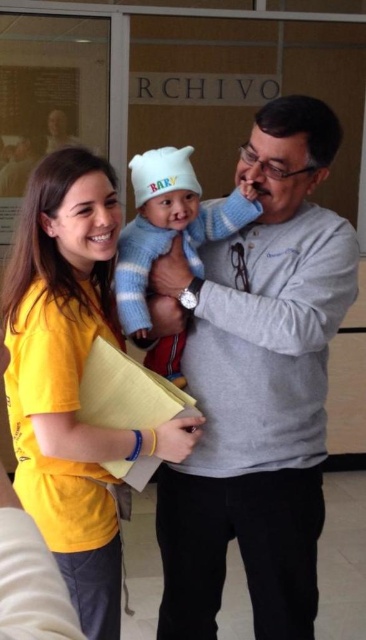
Which is below, yellow fabric shirt at center or blue striped sweater at center?

yellow fabric shirt at center is below.

The height and width of the screenshot is (640, 366). Find the location of `yellow fabric shirt at center`. yellow fabric shirt at center is located at coordinates (71, 378).

Which is behind, point (178, 429) or point (118, 314)?

The point (118, 314) is behind.

In order to click on yellow fabric shirt at center in this screenshot , I will do `click(71, 378)`.

Is gray cotton sweater at center smaller than blue striped sweater at center?

Actually, gray cotton sweater at center might be larger than blue striped sweater at center.

How much distance is there between gray cotton sweater at center and blue striped sweater at center?

A distance of 9.96 inches exists between gray cotton sweater at center and blue striped sweater at center.

At what (x,y) coordinates should I click in order to perform the action: click on gray cotton sweater at center. Please return your answer as a coordinate pair (x, y). This screenshot has width=366, height=640. Looking at the image, I should click on (258, 387).

Who is higher up, gray cotton sweater at center or yellow fabric shirt at center?

yellow fabric shirt at center is above.

Can you confirm if gray cotton sweater at center is positioned below yellow fabric shirt at center?

Yes.

What are the coordinates of `gray cotton sweater at center` in the screenshot? It's located at (258, 387).